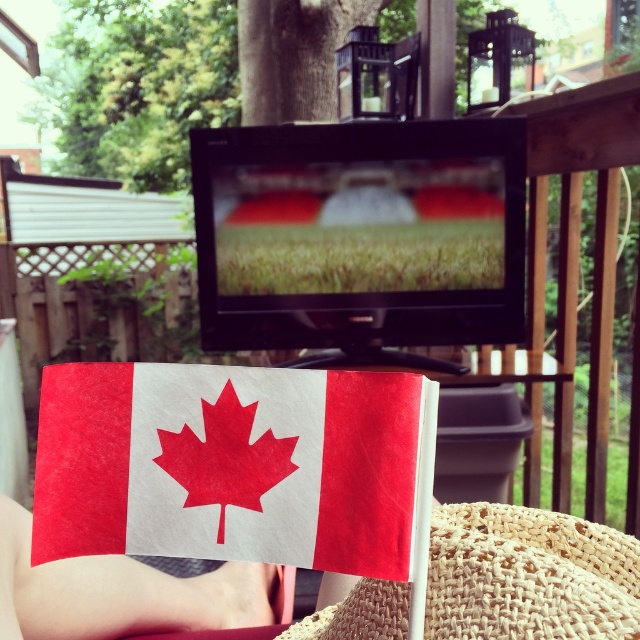
Who is more distant from viewer, (x=397, y=529) or (x=554, y=563)?

The point (x=554, y=563) is behind.

Is point (264, 417) less distant than point (400, 611)?

Yes.

Who is more forward, (70, 404) or (588, 548)?

Point (70, 404)

The height and width of the screenshot is (640, 640). Find the location of `matte paper flag at center`. matte paper flag at center is located at coordinates (228, 465).

Does matte paper flag at center appear on the left side of white paper canadian flag at center?

Incorrect, matte paper flag at center is not on the left side of white paper canadian flag at center.

Does matte paper flag at center have a lesser width compared to white paper canadian flag at center?

Yes.

Between point (401, 392) and point (76, 582), which one is positioned in front?

Point (401, 392) is in front.

Where is `matte paper flag at center`? This screenshot has height=640, width=640. matte paper flag at center is located at coordinates (228, 465).

Can you confirm if woven straw hat at lower center is positioned above white paper canadian flag at center?

Yes, woven straw hat at lower center is above white paper canadian flag at center.

Which is below, woven straw hat at lower center or white paper canadian flag at center?

Positioned lower is white paper canadian flag at center.

This screenshot has width=640, height=640. I want to click on woven straw hat at lower center, so click(x=529, y=576).